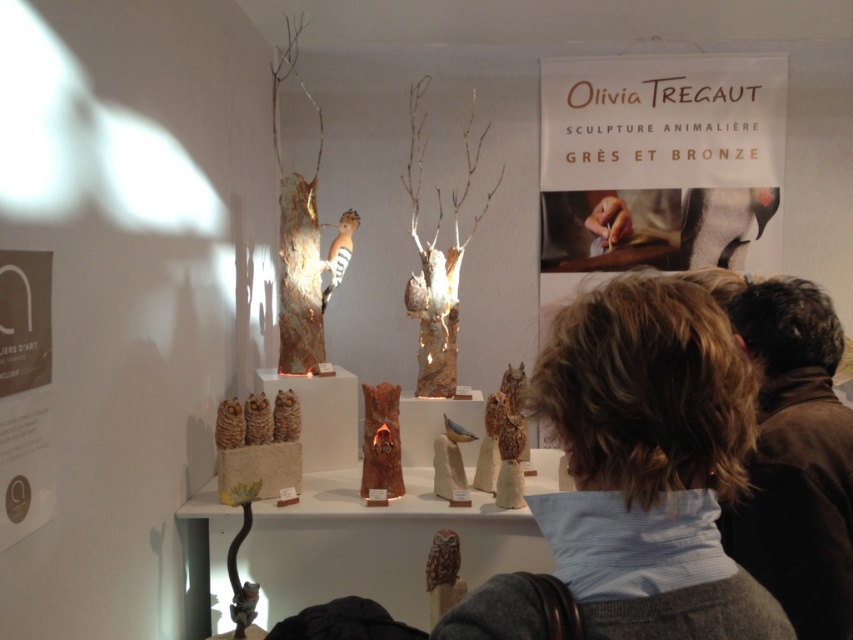
You are standing at the entrance of the art exhibition and want to locate the matte brown wood owl at center. According to the coordinates provided, where should you look relative to the image frame?

The matte brown wood owl at center is located at coordinates point (381, 440), which is approximately 69 percent from the left edge and 45 percent from the top edge of the image frame.